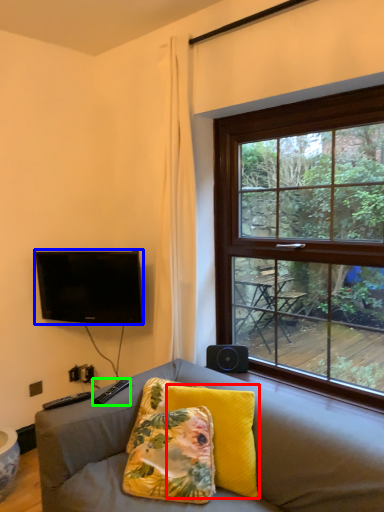
Question: Which object is the farthest from pillow (highlighted by a red box)? Choose among these: television (highlighted by a blue box) or remote (highlighted by a green box).

Choices:
 (A) television
 (B) remote

Answer: (A)